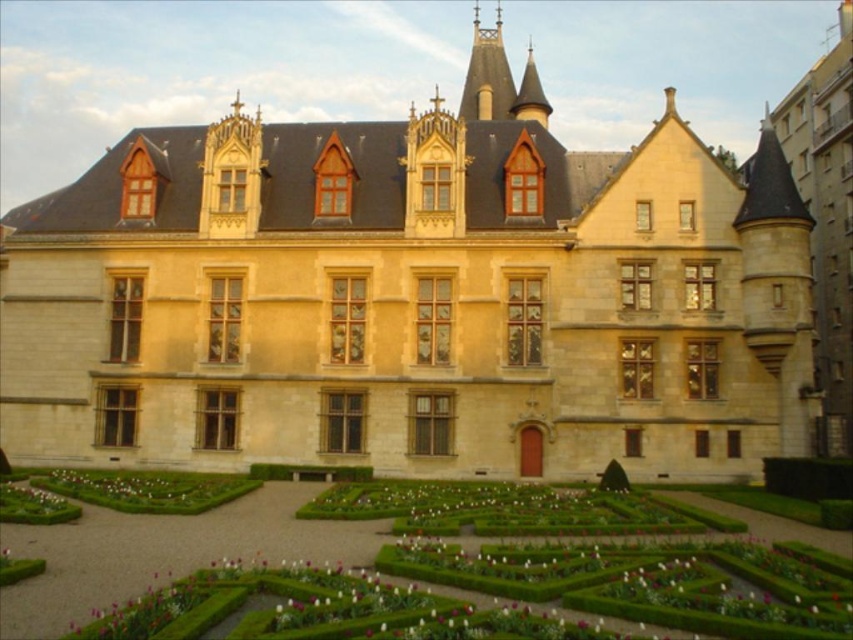
Question: Observing the image, what is the correct spatial positioning of beige stone palace at center in reference to green hedge maze at lower center?

Choices:
 (A) right
 (B) left

Answer: (B)

Question: Which of the following is the farthest from the observer?

Choices:
 (A) beige stone palace at center
 (B) green hedge maze at lower center
 (C) green leafy hedge at lower right
 (D) green leafy hedge at center

Answer: (D)

Question: Estimate the real-world distances between objects in this image. Which object is closer to the green leafy hedge at lower right?

Choices:
 (A) beige stone palace at center
 (B) green leafy hedge at center
 (C) green hedge maze at lower center

Answer: (C)

Question: Which of the following is the farthest from the observer?

Choices:
 (A) green leafy hedge at lower right
 (B) green leafy hedge at center
 (C) beige stone palace at center
 (D) green hedge maze at lower center

Answer: (B)

Question: Does green leafy hedge at lower right have a lesser width compared to green leafy hedge at center?

Choices:
 (A) yes
 (B) no

Answer: (A)

Question: Does beige stone palace at center have a lesser width compared to green hedge maze at lower center?

Choices:
 (A) yes
 (B) no

Answer: (B)